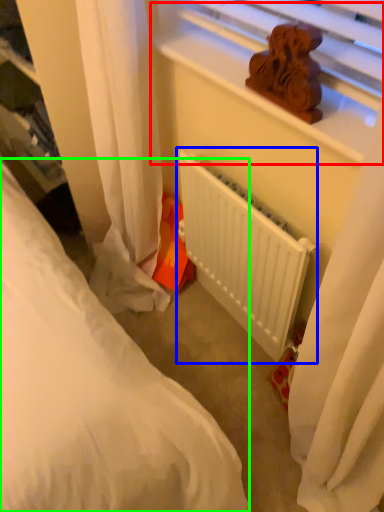
Question: Estimate the real-world distances between objects in this image. Which object is farther from window sill (highlighted by a red box), radiator (highlighted by a blue box) or bed (highlighted by a green box)?

Choices:
 (A) radiator
 (B) bed

Answer: (B)